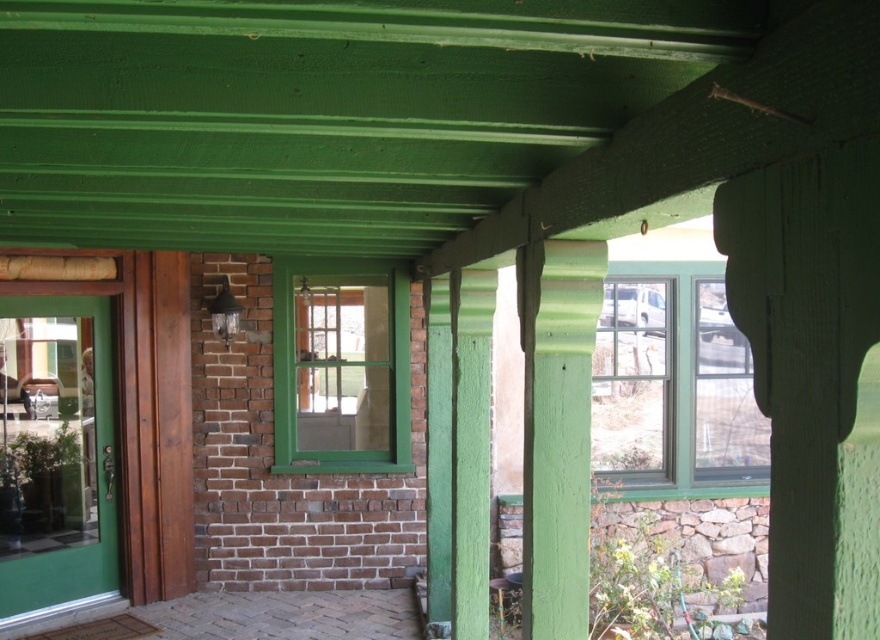
You are standing directly under the porch and looking up at the green painted wood columns and the green porch ceiling beams. There is a window located at point (673, 381). Based on the scene description, which object is closer to you, the green painted wood columns or the green porch ceiling beams?

The green painted wood columns are closer to you than the green porch ceiling beams because the columns support the ceiling, placing them at a lower position under the porch.

You are standing on the porch and want to place a decoration between the two points, point (x=612, y=264) and point (x=563, y=298). Which point should you stand closer to in order to place the decoration in front of the other point?

To place the decoration between the two points, you should stand closer to point (x=563, y=298) because point (x=612, y=264) is behind it.